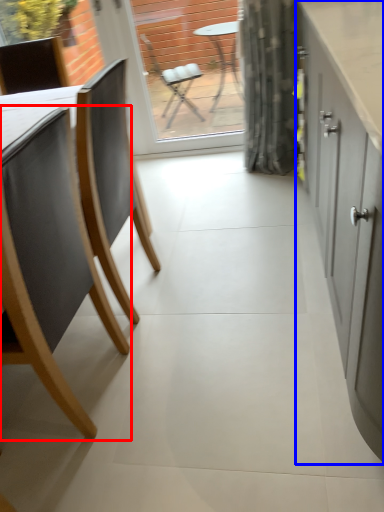
Question: Which object appears farthest to the camera in this image, chair (highlighted by a red box) or cabinetry (highlighted by a blue box)?

Choices:
 (A) chair
 (B) cabinetry

Answer: (A)